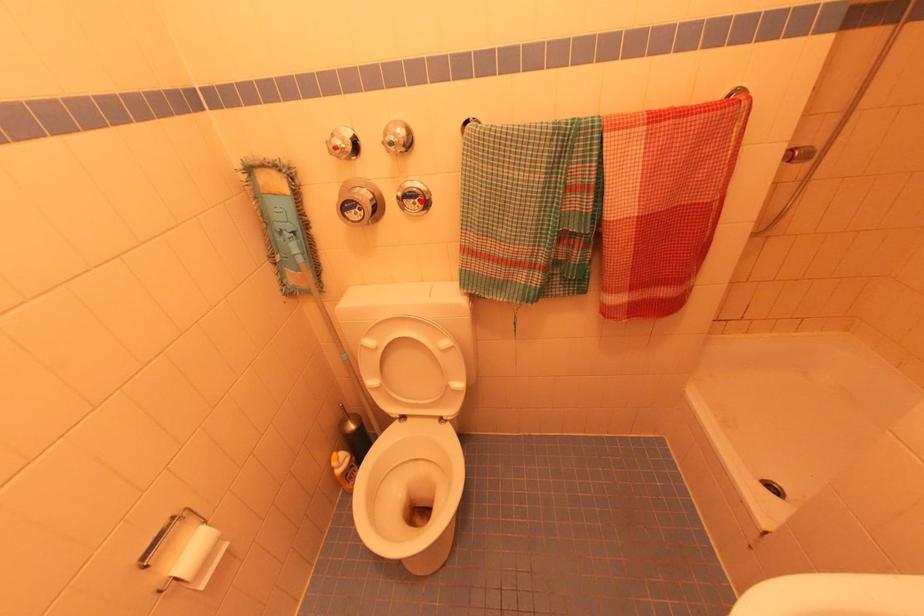
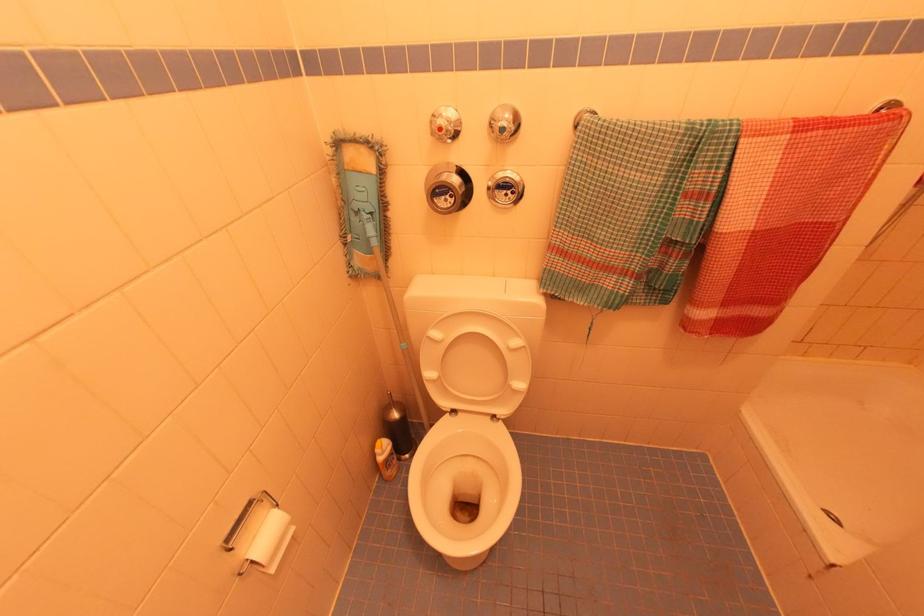
Locate, in the second image, the point that corresponds to the highlighted location in the first image.

(515, 193)